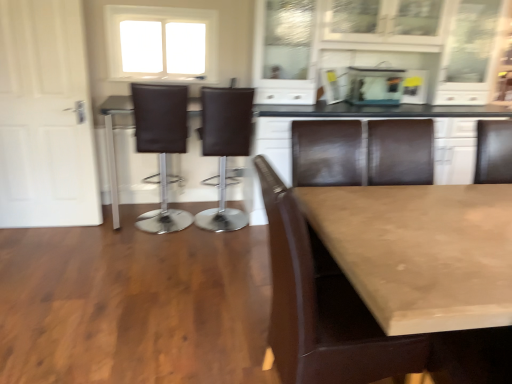
What is the approximate width of brown leather chair at center, the 1th chair positioned from the back?

brown leather chair at center, the 1th chair positioned from the back, is 47.54 centimeters wide.

What is the approximate width of brown leather bar stool at center, which is the 3th chair in right-to-left order?

It is 18.53 inches.

Where is `transparent glass aquarium at upper center`? This screenshot has height=384, width=512. transparent glass aquarium at upper center is located at coordinates (375, 86).

What do you see at coordinates (322, 306) in the screenshot? Image resolution: width=512 pixels, height=384 pixels. I see `brown leather chair at center, the first chair positioned from the front` at bounding box center [322, 306].

The image size is (512, 384). Find the location of `brown leather chair at center, which is the 2th chair in left-to-right order`. brown leather chair at center, which is the 2th chair in left-to-right order is located at coordinates (225, 147).

Which of these two, smooth beige table at center or brown leather chair at center, which is the 2th chair in left-to-right order, is thinner?

Thinner between the two is brown leather chair at center, which is the 2th chair in left-to-right order.

Is smooth beige table at center next to brown leather chair at center, which appears as the second chair when viewed from the right, and touching it?

No, smooth beige table at center is not making contact with brown leather chair at center, which appears as the second chair when viewed from the right.

Who is more distant, smooth beige table at center or brown leather chair at center, the 1th chair positioned from the back?

brown leather chair at center, the 1th chair positioned from the back, is behind.

In the image, is smooth beige table at center on the left side or the right side of brown leather chair at center, which appears as the 3th chair when viewed from the front?

Based on their positions, smooth beige table at center is located to the right of brown leather chair at center, which appears as the 3th chair when viewed from the front.

Would you consider white frosted glass window at upper center to be distant from white matte door at left?

No, there isn't a large distance between white frosted glass window at upper center and white matte door at left.

From a real-world perspective, is white frosted glass window at upper center positioned above or below white matte door at left?

white frosted glass window at upper center is situated higher than white matte door at left in the real world.

Can you confirm if white frosted glass window at upper center is wider than white matte door at left?

Yes, white frosted glass window at upper center is wider than white matte door at left.

In the scene shown: Is white frosted glass window at upper center taller or shorter than white matte door at left?

In the image, white frosted glass window at upper center appears to be shorter than white matte door at left.

From the image's perspective, relative to transparent glass aquarium at upper center, is brown leather chair at center, the third chair when ordered from left to right, above or below?

Based on their image positions, brown leather chair at center, the third chair when ordered from left to right, is located beneath transparent glass aquarium at upper center.

Is transparent glass aquarium at upper center at the back of brown leather chair at center, arranged as the first chair when viewed from the right?

That's not correct — brown leather chair at center, arranged as the first chair when viewed from the right, is not looking away from transparent glass aquarium at upper center.

Considering the positions of objects brown leather chair at center, the first chair positioned from the front, and transparent glass aquarium at upper center in the image provided, who is more to the right, brown leather chair at center, the first chair positioned from the front, or transparent glass aquarium at upper center?

transparent glass aquarium at upper center.

Starting from the transparent glass aquarium at upper center, which chair is the 1st one to the left? Please provide its 2D coordinates.

[(322, 306)]

Is smooth beige table at center to the right of white matte door at left from the viewer's perspective?

Yes.

Who is shorter, smooth beige table at center or white matte door at left?

With less height is smooth beige table at center.

How different are the orientations of smooth beige table at center and white matte door at left in degrees?

178 degrees separate the facing orientations of smooth beige table at center and white matte door at left.

Which of these two, smooth beige table at center or white matte door at left, is thinner?

Thinner between the two is white matte door at left.

Is brown leather chair at center, the third chair when ordered from left to right, not near smooth beige table at center?

No.

How many degrees apart are the facing directions of brown leather chair at center, the first chair positioned from the front, and smooth beige table at center?

The angular difference between brown leather chair at center, the first chair positioned from the front, and smooth beige table at center is 88.9 degrees.

Which is more to the right, brown leather chair at center, the first chair positioned from the front, or smooth beige table at center?

smooth beige table at center is more to the right.

Does brown leather bar stool at center, which is the 3th chair in right-to-left order, come in front of brown leather chair at center, which is the 3th chair in back-to-front order?

No.

Considering the relative sizes of brown leather bar stool at center, marked as the first chair in a left-to-right arrangement, and brown leather chair at center, the first chair positioned from the front, in the image provided, is brown leather bar stool at center, marked as the first chair in a left-to-right arrangement, wider than brown leather chair at center, the first chair positioned from the front,?

No.

Does brown leather bar stool at center, which is the 3th chair in right-to-left order, contain brown leather chair at center, which is the 3th chair in back-to-front order?

No, brown leather chair at center, which is the 3th chair in back-to-front order, is not inside brown leather bar stool at center, which is the 3th chair in right-to-left order.

Is brown leather bar stool at center, marked as the first chair in a left-to-right arrangement, positioned with its back to brown leather chair at center, the first chair positioned from the front?

No.

Consider the image. Is transparent glass aquarium at upper center positioned beyond the bounds of smooth beige table at center?

Yes, transparent glass aquarium at upper center is not within smooth beige table at center.

Are transparent glass aquarium at upper center and smooth beige table at center far apart?

That's right, there is a large distance between transparent glass aquarium at upper center and smooth beige table at center.

Considering the relative sizes of transparent glass aquarium at upper center and smooth beige table at center in the image provided, is transparent glass aquarium at upper center taller than smooth beige table at center?

No.

Find the location of a particular element. chair that is the 3rd one when counting backward from the smooth beige table at center is located at coordinates (225, 147).

Locate an element on the screen. This screenshot has height=384, width=512. door that appears below the white frosted glass window at upper center (from a real-world perspective) is located at coordinates (45, 117).

Looking at the image, which one is located closer to transparent glass aquarium at upper center, white matte door at left or white frosted glass window at upper center?

white frosted glass window at upper center.

Based on their spatial positions, is white frosted glass window at upper center or transparent glass aquarium at upper center closer to brown leather bar stool at center, marked as the first chair in a left-to-right arrangement?

Based on the image, white frosted glass window at upper center appears to be nearer to brown leather bar stool at center, marked as the first chair in a left-to-right arrangement.

Looking at the image, which one is located further to brown leather chair at center, which appears as the second chair when viewed from the right, white frosted glass window at upper center or white matte door at left?

The object further to brown leather chair at center, which appears as the second chair when viewed from the right, is white matte door at left.

Based on their spatial positions, is brown leather chair at center, which appears as the 3th chair when viewed from the front, or white frosted glass window at upper center further from brown leather bar stool at center, positioned as the second chair in back-to-front order?

white frosted glass window at upper center.

From the image, which object appears to be nearer to brown leather bar stool at center, positioned as the second chair in back-to-front order, transparent glass aquarium at upper center or white frosted glass window at upper center?

Based on the image, white frosted glass window at upper center appears to be nearer to brown leather bar stool at center, positioned as the second chair in back-to-front order.

Looking at the image, which one is located further to transparent glass aquarium at upper center, brown leather chair at center, which appears as the 3th chair when viewed from the front, or white frosted glass window at upper center?

Based on the image, white frosted glass window at upper center appears to be further to transparent glass aquarium at upper center.

When comparing their distances from transparent glass aquarium at upper center, does brown leather chair at center, which appears as the 3th chair when viewed from the front, or brown leather bar stool at center, which is the 2th chair in front-to-back order, seem further?

brown leather bar stool at center, which is the 2th chair in front-to-back order.

When comparing their distances from smooth beige table at center, does brown leather chair at center, the 1th chair positioned from the back, or white frosted glass window at upper center seem closer?

Among the two, brown leather chair at center, the 1th chair positioned from the back, is located nearer to smooth beige table at center.

This screenshot has width=512, height=384. In order to click on chair located between brown leather chair at center, the first chair positioned from the front, and brown leather chair at center, the 1th chair positioned from the back, in the depth direction in this screenshot , I will do `click(161, 145)`.

Find the location of `window located between smooth beige table at center and transparent glass aquarium at upper center in the depth direction`. window located between smooth beige table at center and transparent glass aquarium at upper center in the depth direction is located at coordinates (161, 43).

You are a GUI agent. You are given a task and a screenshot of the screen. Output one action in this format:
    pyautogui.click(x=<x>, y=<y>)
    Task: Click on the chair between smooth beige table at center and brown leather bar stool at center, which is the 3th chair in right-to-left order, from front to back
    This screenshot has width=512, height=384.
    Given the screenshot: What is the action you would take?
    pyautogui.click(x=322, y=306)

Locate an element on the screen. This screenshot has height=384, width=512. window between white matte door at left and brown leather chair at center, which is the 2th chair in left-to-right order, in the horizontal direction is located at coordinates (161, 43).